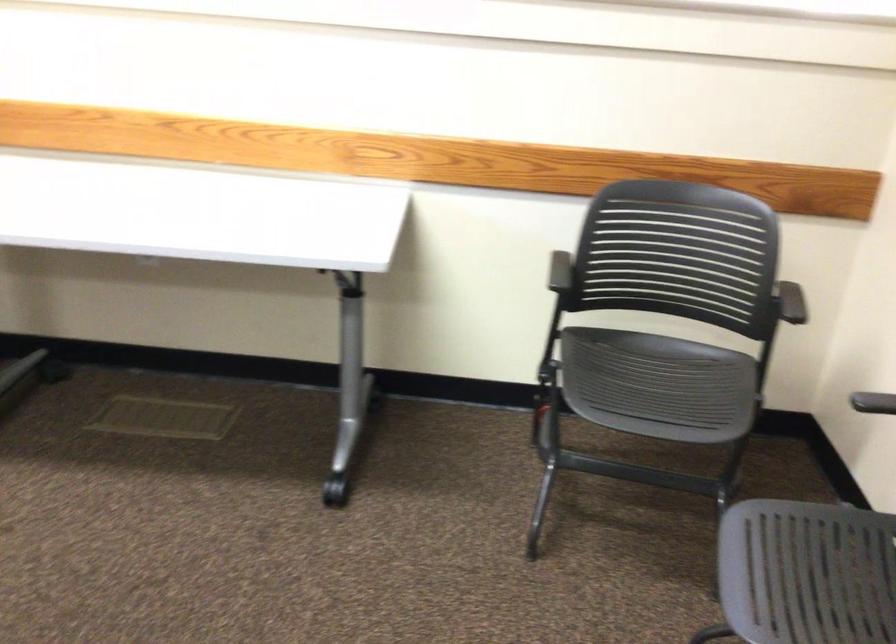
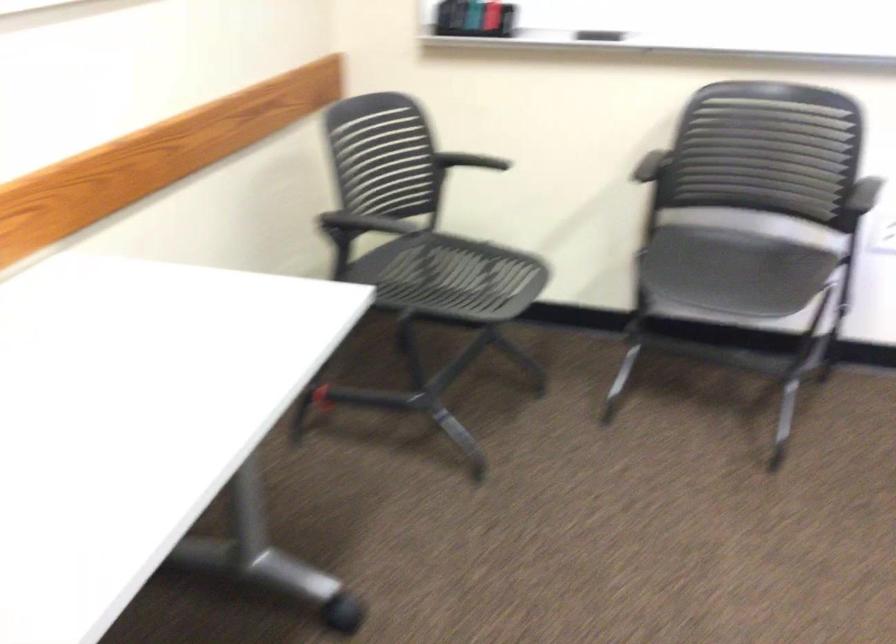
In the second image, find the point that corresponds to the point at 554,267 in the first image.

(364, 223)